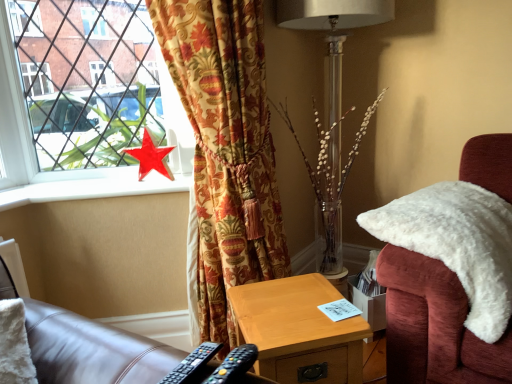
Question: From the image's perspective, is black plastic remote control at lower center, the second remote control positioned from the right, located above or below wooden nightstand at lower center?

Choices:
 (A) below
 (B) above

Answer: (B)

Question: From a real-world perspective, relative to wooden nightstand at lower center, is black plastic remote control at lower center, the second remote control positioned from the right, vertically above or below?

Choices:
 (A) above
 (B) below

Answer: (A)

Question: Which object is the closest to the white fluffy chair at right?

Choices:
 (A) metallic red star at left
 (B) red glossy star at window
 (C) white smooth window sill at upper left
 (D) wooden nightstand at lower center
 (E) black plastic remote control at lower center, the first remote control in the left-to-right sequence

Answer: (D)

Question: Estimate the real-world distances between objects in this image. Which object is closer to the metallic red star at left?

Choices:
 (A) metallic silver table lamp at center
 (B) black plastic remote control at lower center, the second remote control positioned from the right
 (C) velvet floral curtain at left
 (D) wooden nightstand at lower center
 (E) black plastic remote control at lower center, which appears as the 2th remote control when viewed from the left

Answer: (C)